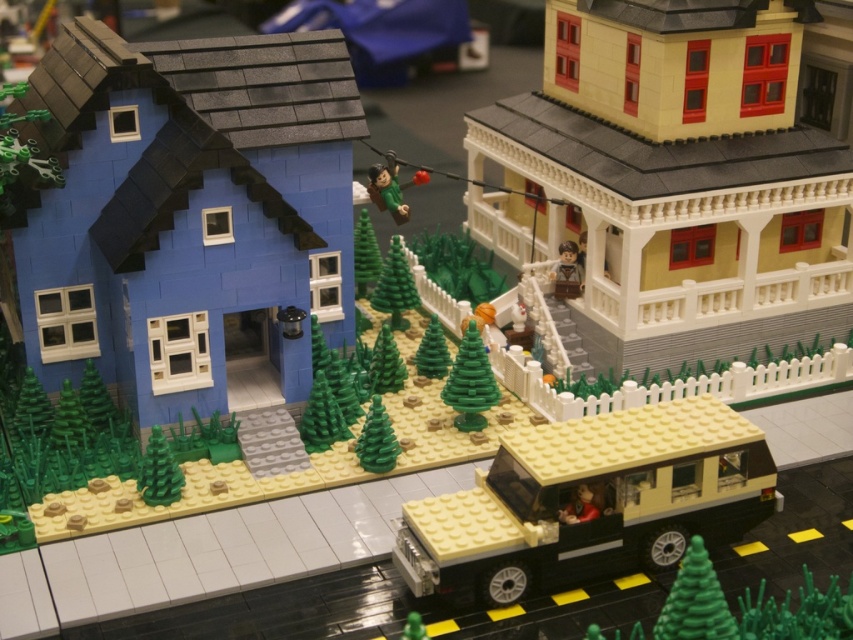
Question: Can you confirm if smooth black roof at upper center is positioned above green matte tree at center?

Choices:
 (A) yes
 (B) no

Answer: (A)

Question: Which of these objects is positioned farthest from the green matte figure at lower center?

Choices:
 (A) green matte christmas tree at center
 (B) green matte tree at center
 (C) smooth black roof at upper center

Answer: (C)

Question: Considering the relative positions of smooth black roof at upper center and green matte figure at lower center in the image provided, where is smooth black roof at upper center located with respect to green matte figure at lower center?

Choices:
 (A) right
 (B) left

Answer: (B)

Question: Is matte yellow plastic car at center to the left of smooth black roof at upper center from the viewer's perspective?

Choices:
 (A) no
 (B) yes

Answer: (A)

Question: Based on their relative distances, which object is farther from the green matte christmas tree at center?

Choices:
 (A) smooth black roof at upper center
 (B) green matte figure at lower center
 (C) green matte tree at center
 (D) green matte figure at center

Answer: (A)

Question: Which of these objects is positioned closest to the green matte tree at center?

Choices:
 (A) green matte christmas tree at center
 (B) matte yellow plastic car at center

Answer: (A)